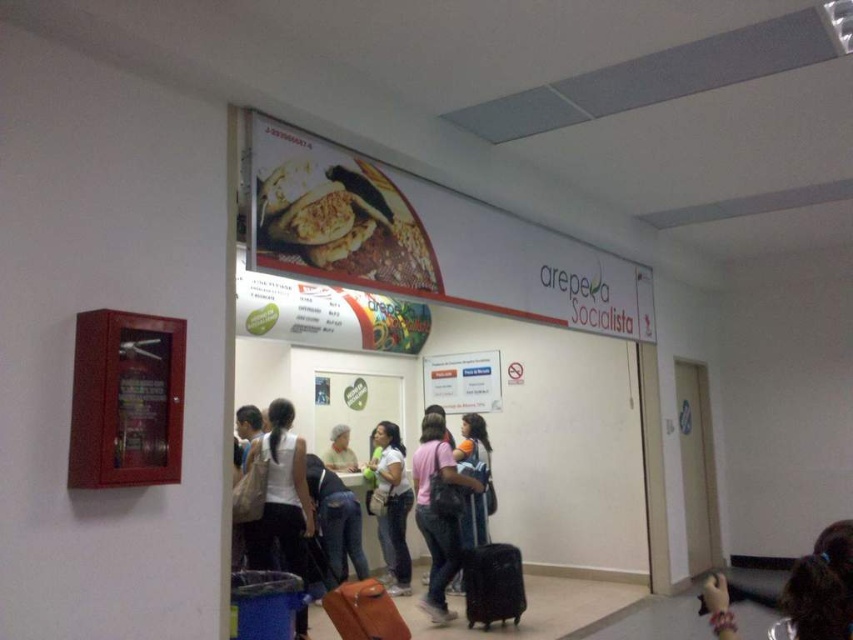
You are a customer at the food stall named Arepe Socialista. You notice a matte white shirt at center and a black matte suitcase at lower center. Which item is positioned higher in the image?

The matte white shirt at center is located above the black matte suitcase at lower center, so it is positioned higher in the image.